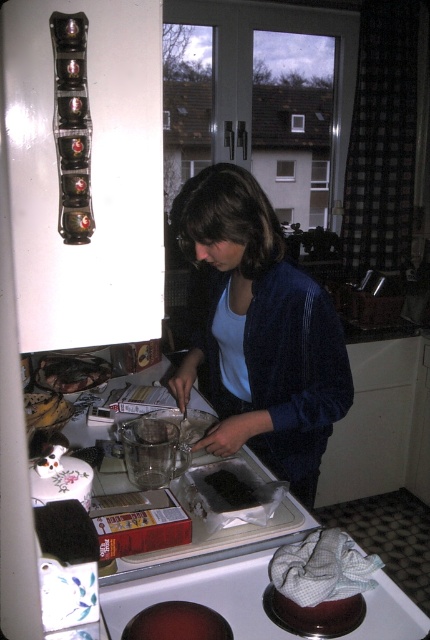
You are a chef preparing desserts in the kitchen. You have a dark brown cake at lower center and a brown crumbly cake at lower left. Which cake is located directly below the other?

The dark brown cake at lower center is positioned under the brown crumbly cake at lower left, so the dark brown cake at lower center is directly below the brown crumbly cake at lower left.

You are organizing a kitchen pantry and need to place the blue velvety jacket at center and the brown crumbly cake at lower left on a shelf. If the shelf has limited space, which item should you prioritize placing first based on their sizes?

The blue velvety jacket at center is larger than the brown crumbly cake at lower left. Therefore, you should prioritize placing the blue velvety jacket at center first to ensure it fits on the shelf.